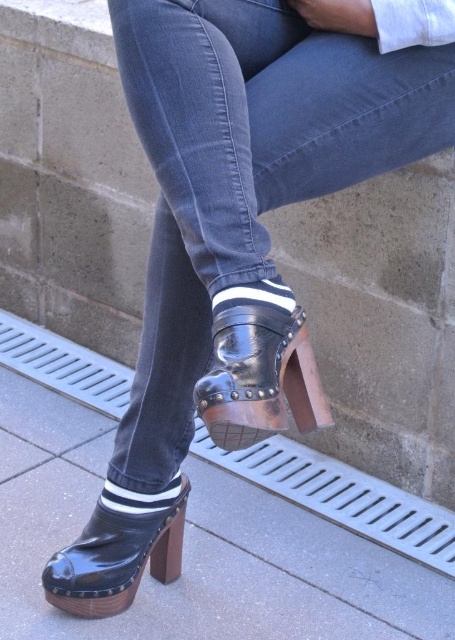
You are a fashion designer trying to create a cohesive outfit. You have a denim at center and a shiny black sandal at center. Which item should you adjust in height to ensure they match in height?

Since the denim at center is taller than the shiny black sandal at center, you should shorten the denim at center or raise the shiny black sandal at center to make them match in height.

You are a fashion designer measuring the distance between the denim at center and the viewer for a new collection. What is the exact distance in centimeters?

The exact distance between the denim at center and the viewer is 83.73 centimeters.

You are a fashion designer trying to create a coordinated outfit. You have two footwear options in the image. Which one is taller between the glossy wood curb at lower center and the shiny black sandal at center?

The glossy wood curb at lower center is taller than the shiny black sandal at center according to the description.